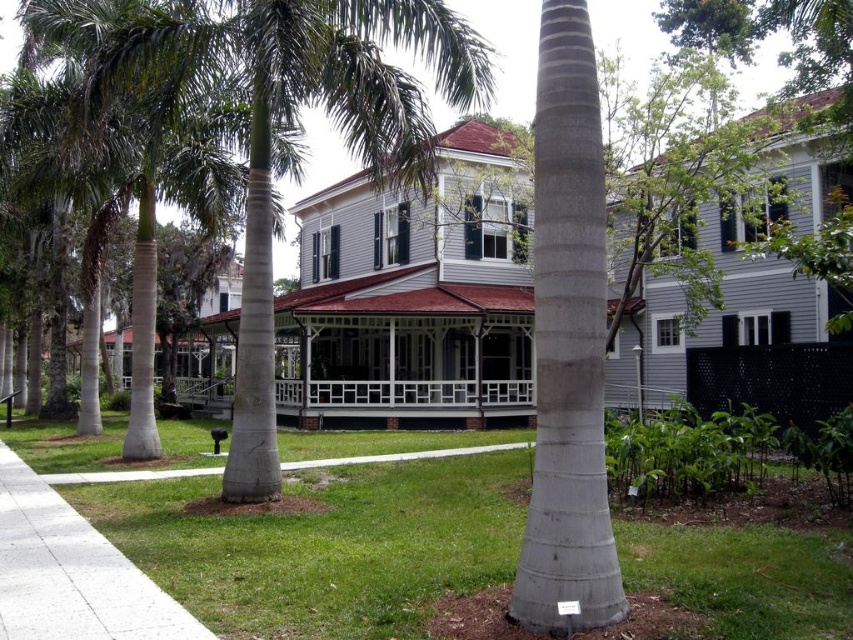
Question: Based on their relative distances, which object is nearer to the concrete at center?

Choices:
 (A) green grass at center
 (B) green leafy palm tree at center
 (C) gray textured palm tree trunk at center

Answer: (C)

Question: Which object is the closest to the gray textured palm tree trunk at center?

Choices:
 (A) green grass at center
 (B) green leafy palm tree at center

Answer: (A)

Question: Is green leafy palm tree at center below gray textured palm tree trunk at center?

Choices:
 (A) yes
 (B) no

Answer: (B)

Question: Does green grass at center have a smaller size compared to gray textured palm tree trunk at center?

Choices:
 (A) yes
 (B) no

Answer: (A)

Question: Is green leafy palm tree at center behind gray textured palm tree trunk at center?

Choices:
 (A) yes
 (B) no

Answer: (A)

Question: Which of the following is the closest to the observer?

Choices:
 (A) gray textured palm tree trunk at center
 (B) green leafy palm tree at center
 (C) concrete at center

Answer: (A)